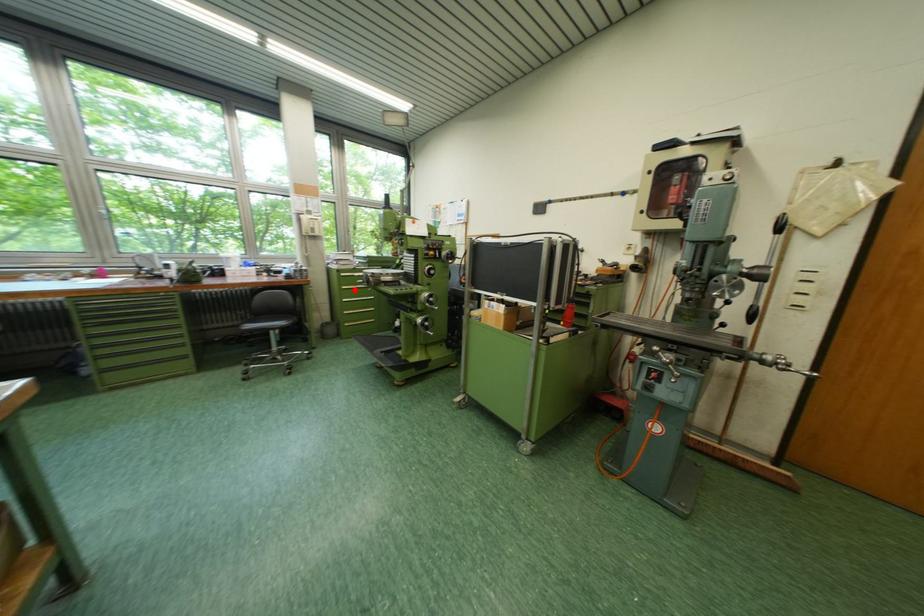
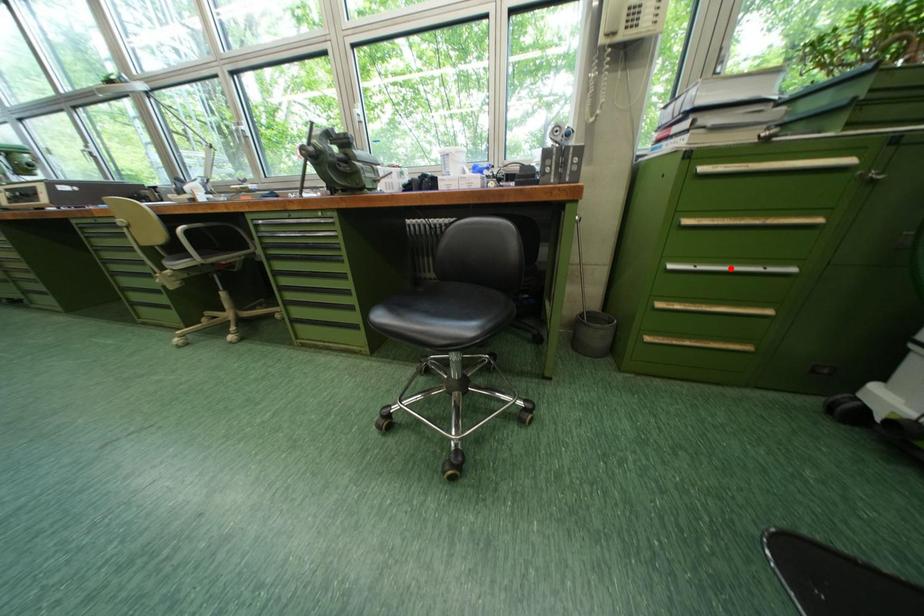
I am providing you with two images of the same scene from different viewpoints. A red point is marked on the first image and another point is marked on the second image. Does the point marked in image1 correspond to the same location as the one in image2?

No